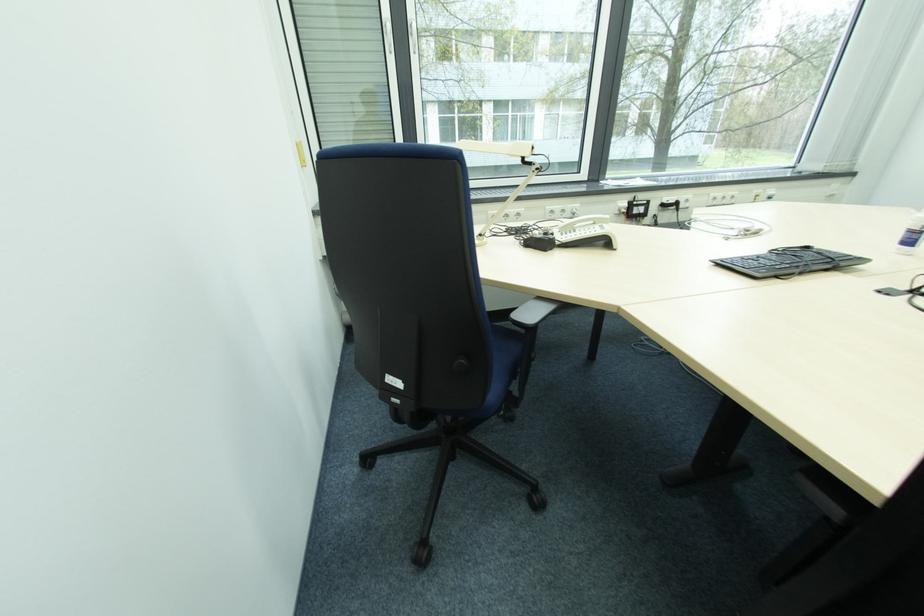
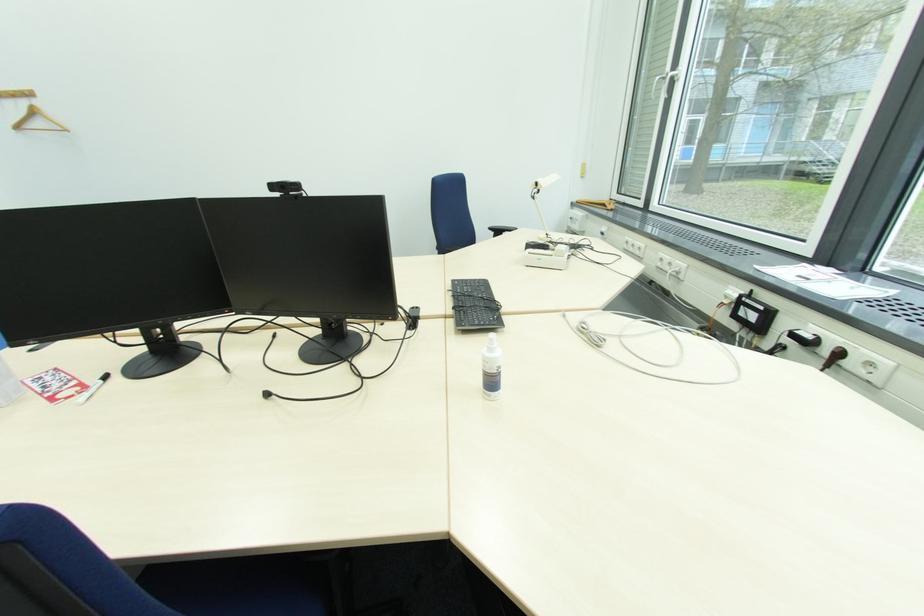
Locate, in the second image, the point that corresponds to the point at 767,273 in the first image.

(459, 285)